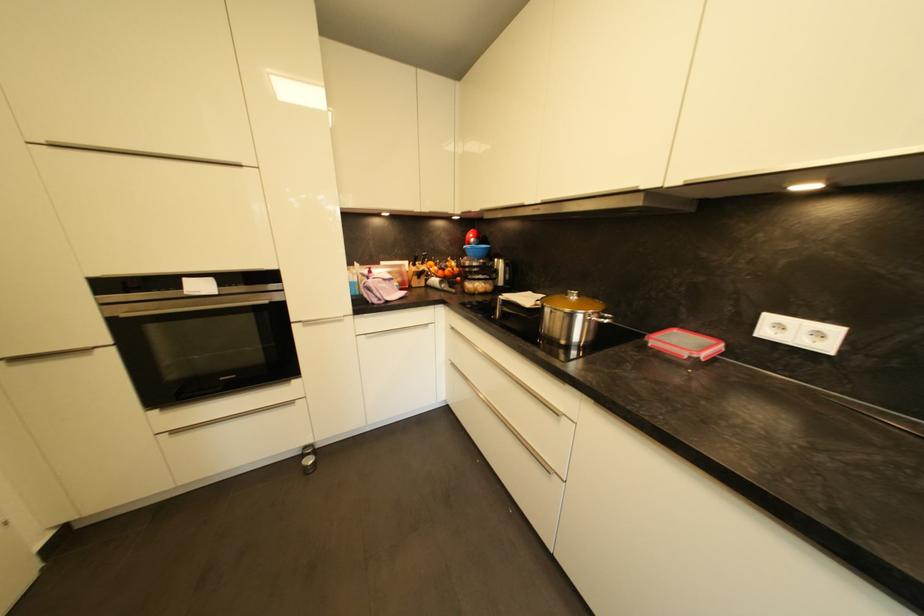
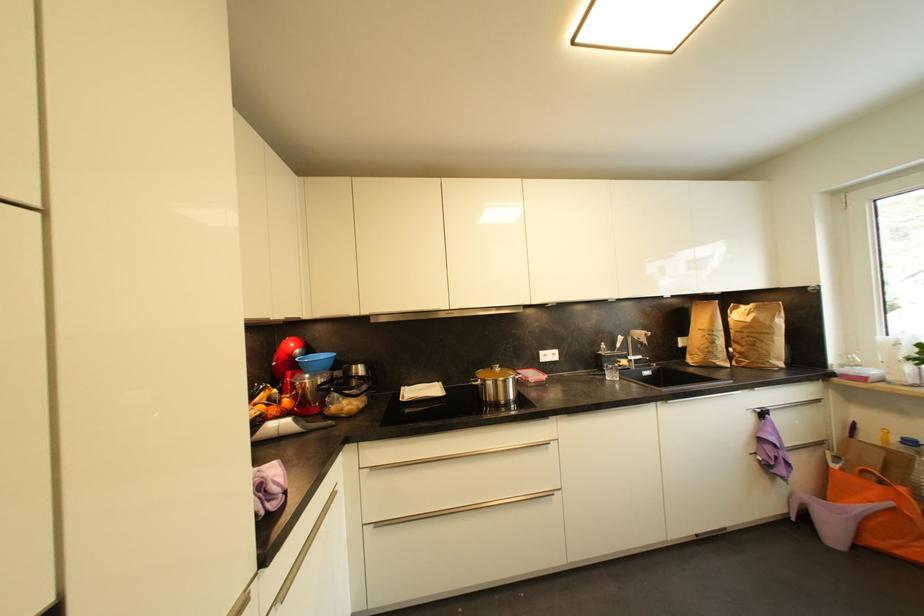
Locate, in the second image, the point that corresponds to the point at 578,299 in the first image.

(503, 371)